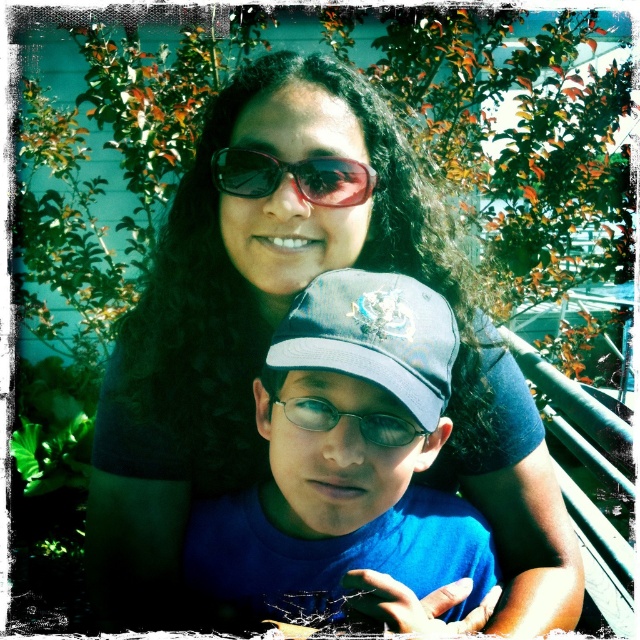
Question: Is matte black sunglasses at upper center below blue fabric baseball cap at center?

Choices:
 (A) yes
 (B) no

Answer: (A)

Question: Considering the real-world distances, which object is closest to the sunglasses at upper center?

Choices:
 (A) matte black sunglasses at upper center
 (B) clear plastic glasses at center

Answer: (A)

Question: Which of the following is the farthest from the observer?

Choices:
 (A) (304, 428)
 (B) (272, 493)

Answer: (B)

Question: Can you confirm if blue fabric baseball cap at center is bigger than sunglasses at upper center?

Choices:
 (A) no
 (B) yes

Answer: (B)

Question: Which object is farther from the camera taking this photo?

Choices:
 (A) blue fabric baseball cap at center
 (B) clear plastic glasses at center
 (C) sunglasses at upper center

Answer: (C)

Question: Can you confirm if matte black sunglasses at upper center is thinner than sunglasses at upper center?

Choices:
 (A) yes
 (B) no

Answer: (B)